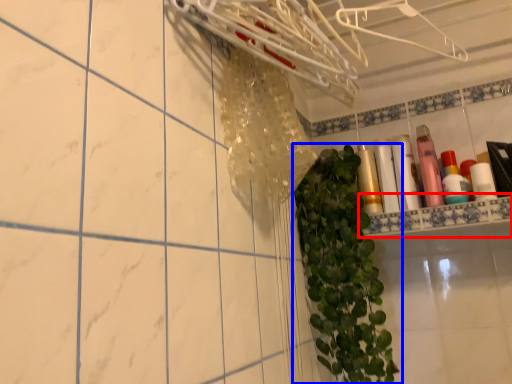
Question: Which object is closer to the camera taking this photo, ledge (highlighted by a red box) or houseplant (highlighted by a blue box)?

Choices:
 (A) ledge
 (B) houseplant

Answer: (B)